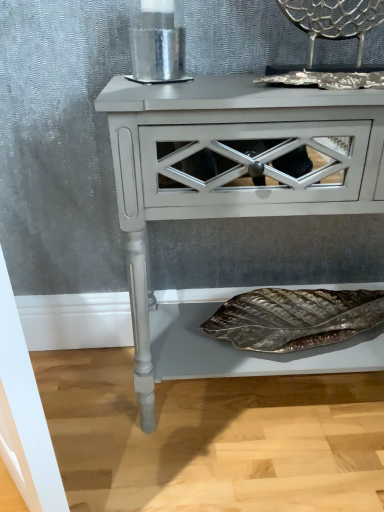
The width and height of the screenshot is (384, 512). Identify the location of vacant space in front of matte white nightstand at center. click(280, 469).